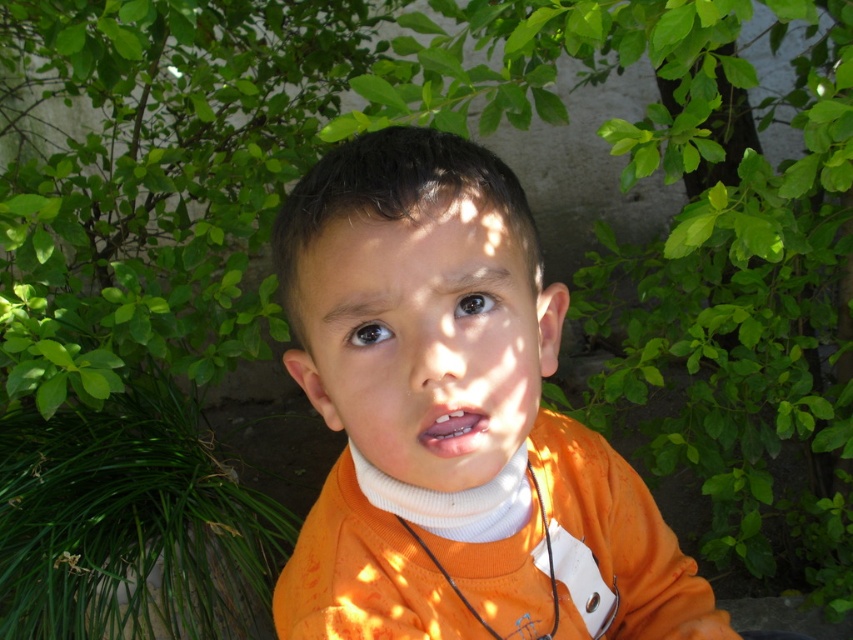
In the scene shown: You are a photographer adjusting your camera focus. You need to focus on two points in the scene. The first point is point (379, 349) and the second is point (535, 371). Which point should you focus on first if you want to ensure both points are in focus?

You should focus on point (379, 349) first because it is closer to the camera than point (535, 371). This way, adjusting the focus from near to far will help both points come into focus.

The child is holding a toy that is 10 cm tall. If the toy is placed on the orange matte shirt at center, will it be visible above the matte orange mouth at center?

The orange matte shirt at center is located above the matte orange mouth at center. Since the shirt is already above the mouth, placing a 10 cm tall toy on the shirt would position it even higher, making it visible above the matte orange mouth at center.

Based on the coordinates provided, where is the orange fabric shirt at center located in the image?

The orange fabric shirt at center is located at the 2D coordinates point (450,404).